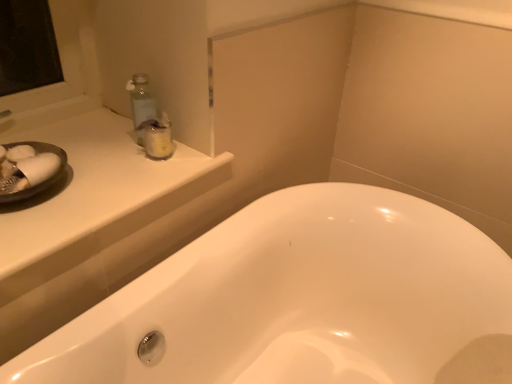
Where is `vacant region to the left of clear plastic jar at upper left`? The height and width of the screenshot is (384, 512). vacant region to the left of clear plastic jar at upper left is located at coordinates coord(103,155).